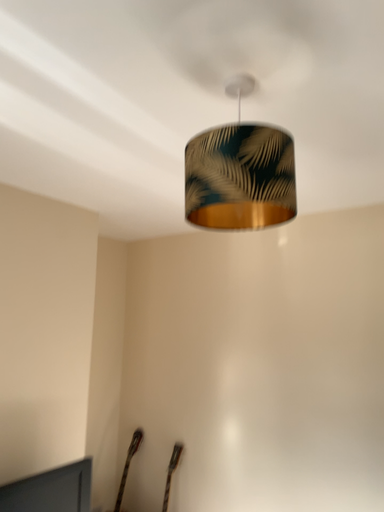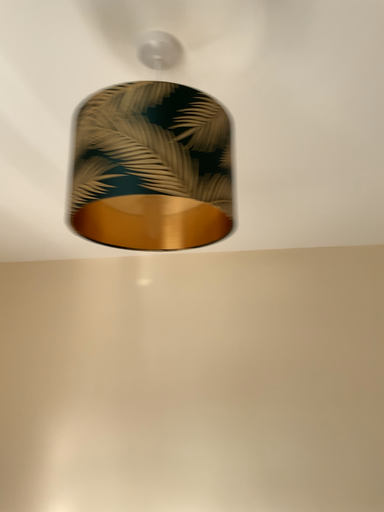
Question: How did the camera likely rotate when shooting the video?

Choices:
 (A) rotated left
 (B) rotated right

Answer: (B)